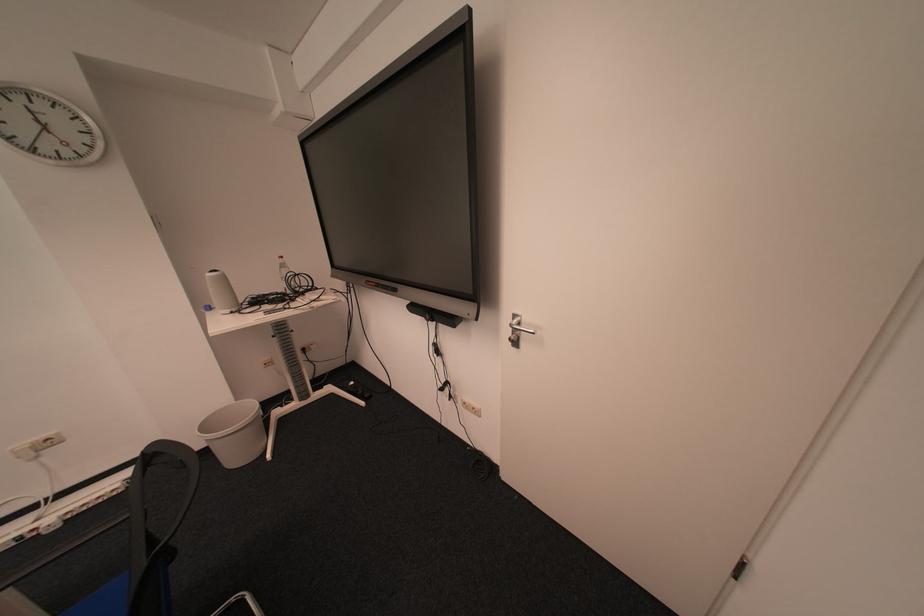
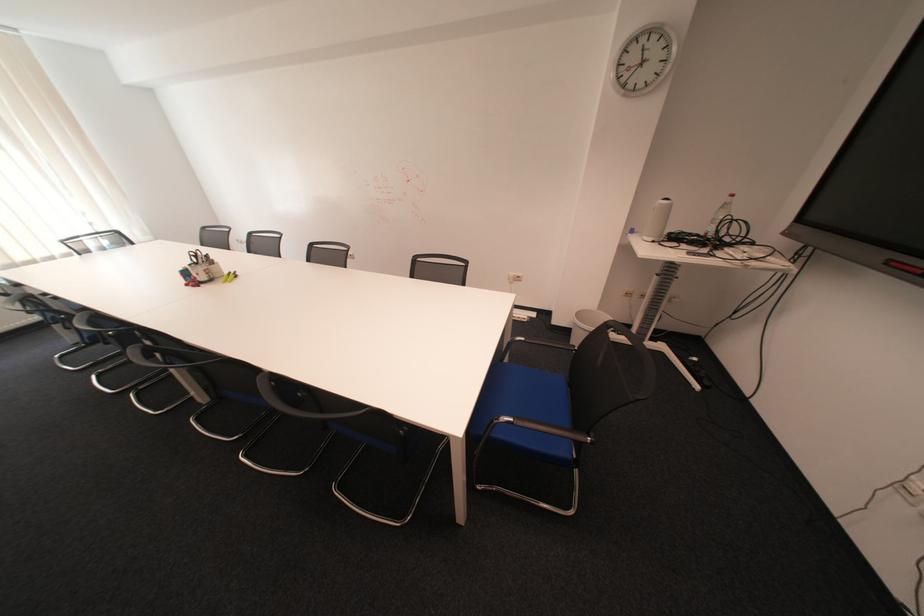
Locate, in the second image, the point that corresponds to point (221, 309) in the first image.

(643, 232)